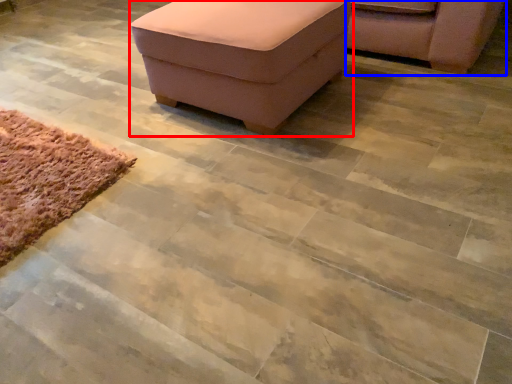
Question: Which of the following is the closest to the observer, furniture (highlighted by a red box) or chair (highlighted by a blue box)?

Choices:
 (A) furniture
 (B) chair

Answer: (A)